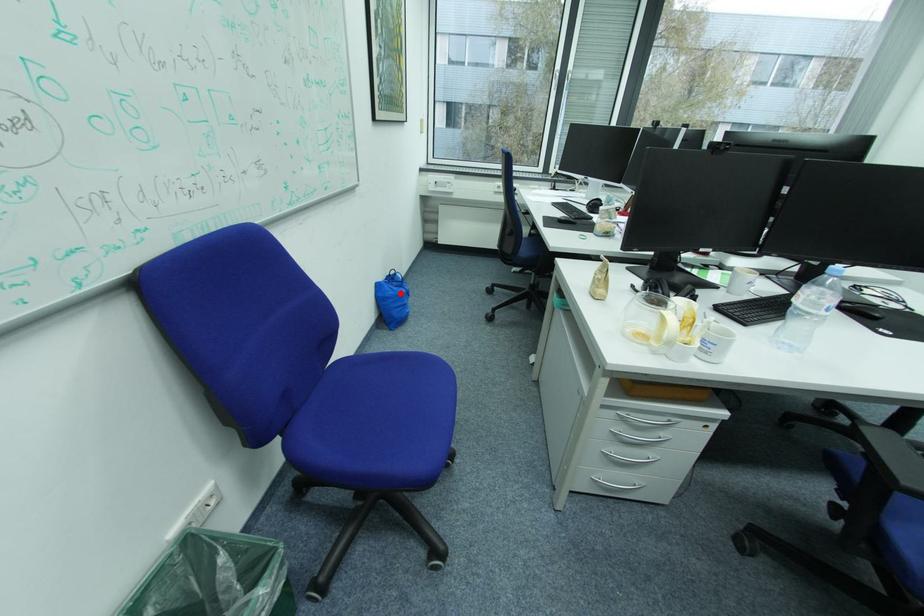
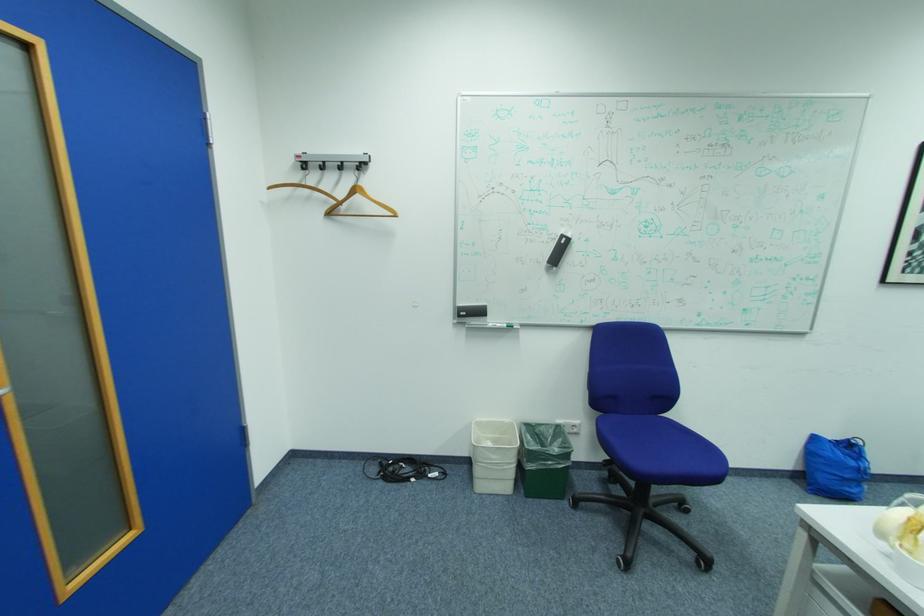
Where in the second image is the point corresponding to the highlighted location from the first image?

(839, 456)